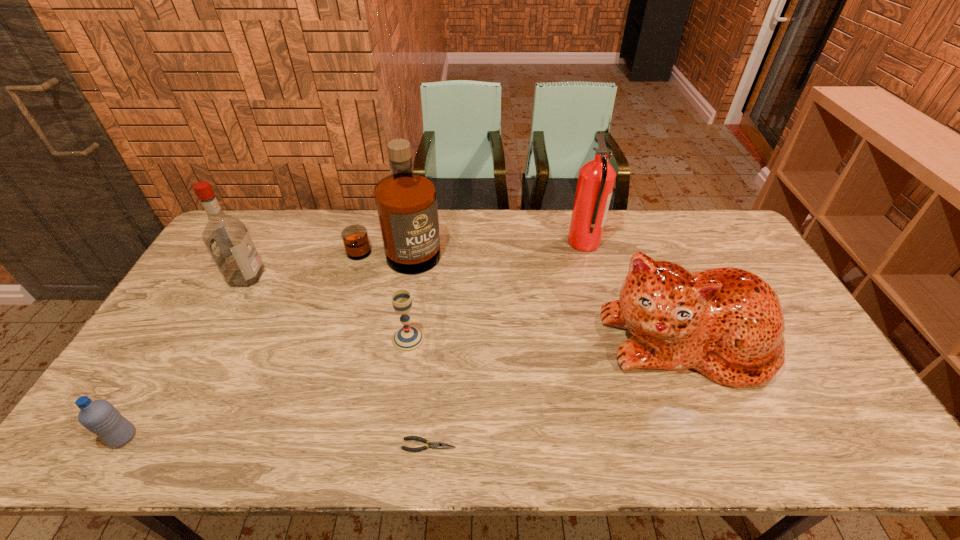
In order to click on pliers situated at the near edge in this screenshot , I will do `click(434, 445)`.

Locate an element on the screen. liquor positioned at the left edge is located at coordinates (227, 239).

Locate an element on the screen. Image resolution: width=960 pixels, height=540 pixels. water bottle located at the left edge is located at coordinates (100, 417).

Locate an element on the screen. Image resolution: width=960 pixels, height=540 pixels. object situated at the right edge is located at coordinates (727, 323).

Find the location of `object located at the near left corner`. object located at the near left corner is located at coordinates (100, 417).

Find the location of a particular element. vacant point at the far edge is located at coordinates (546, 222).

Find the location of a particular element. This screenshot has height=540, width=960. vacant space at the near edge of the desktop is located at coordinates [x=369, y=435].

The height and width of the screenshot is (540, 960). I want to click on free space at the left edge of the desktop, so click(x=198, y=306).

In the image, there is a desktop. Where is `free space at the right edge`? Image resolution: width=960 pixels, height=540 pixels. free space at the right edge is located at coordinates (745, 267).

I want to click on vacant space at the far right corner of the desktop, so click(x=712, y=239).